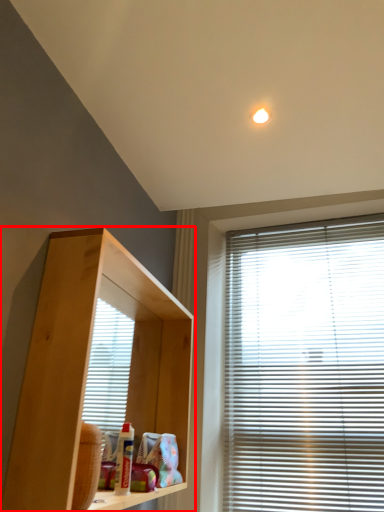
Question: From the image's perspective, what is the correct spatial relationship of shelf (annotated by the red box) in relation to window blind?

Choices:
 (A) below
 (B) above

Answer: (B)